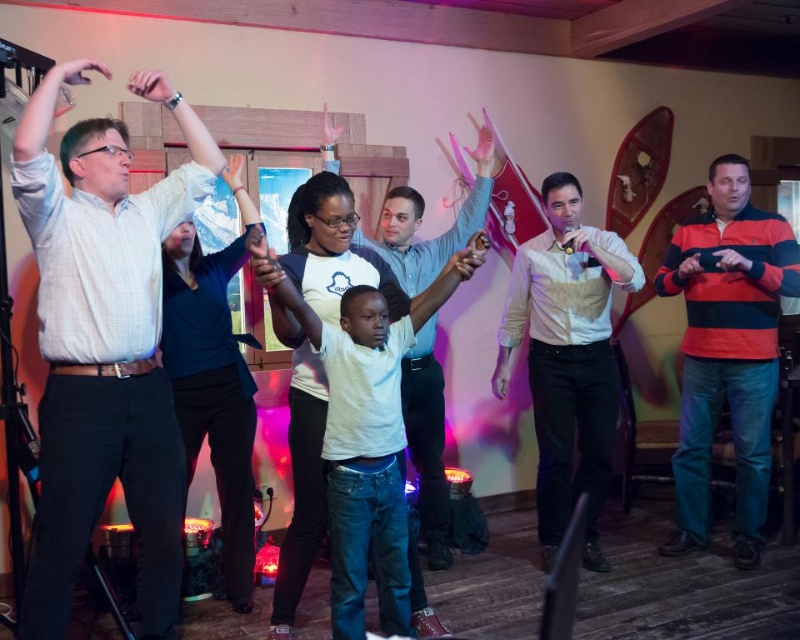
Question: Which point appears farthest from the camera in this image?

Choices:
 (A) (718, 264)
 (B) (454, 275)

Answer: (A)

Question: Does striped cotton sweater at right have a greater width compared to light brown textured shirt at center?

Choices:
 (A) yes
 (B) no

Answer: (A)

Question: Does light blue shirt at center appear over white matte shirt at center?

Choices:
 (A) no
 (B) yes

Answer: (B)

Question: Which of the following is the farthest from the observer?

Choices:
 (A) click(344, 294)
 (B) click(542, 540)
 (C) click(424, 397)
 (D) click(52, 182)

Answer: (B)

Question: Is light brown textured shirt at center positioned before white matte shirt at center?

Choices:
 (A) yes
 (B) no

Answer: (B)

Question: Which point appears closest to the camera in this image?

Choices:
 (A) (760, 376)
 (B) (316, 349)

Answer: (B)